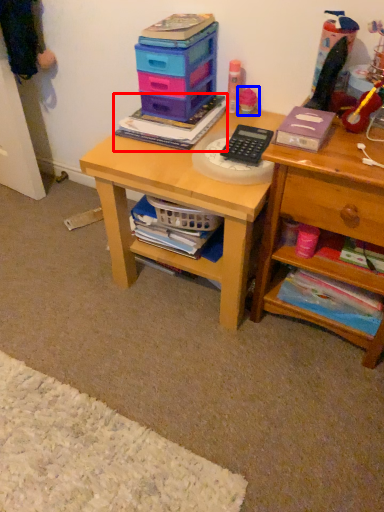
Question: Which object is further to the camera taking this photo, book (highlighted by a red box) or toy (highlighted by a blue box)?

Choices:
 (A) book
 (B) toy

Answer: (B)